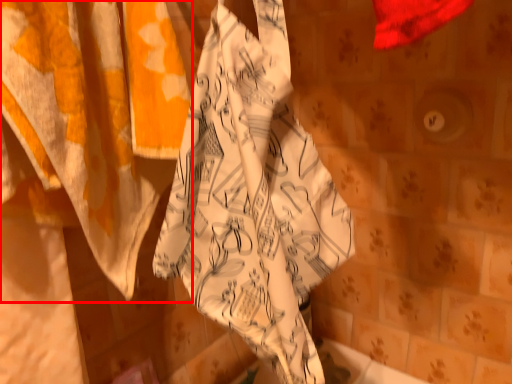
Question: Where is curtain (annotated by the red box) located in relation to towel in the image?

Choices:
 (A) right
 (B) left

Answer: (B)